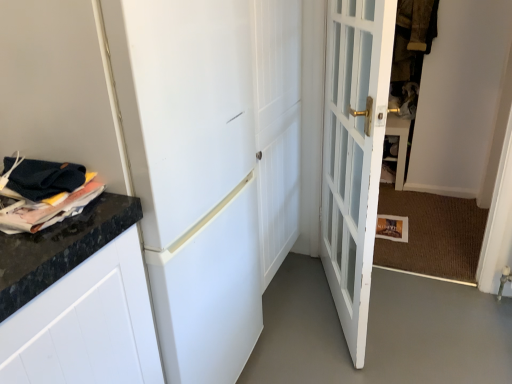
The width and height of the screenshot is (512, 384). What are the coordinates of `vacant space in front of white glass door at center, acting as the 1th door starting from the right` in the screenshot? It's located at (374, 352).